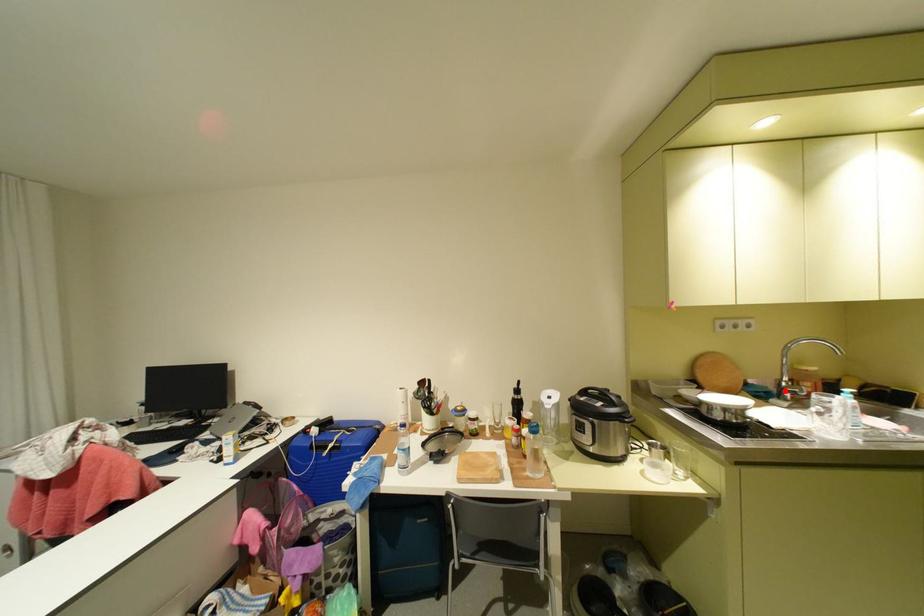
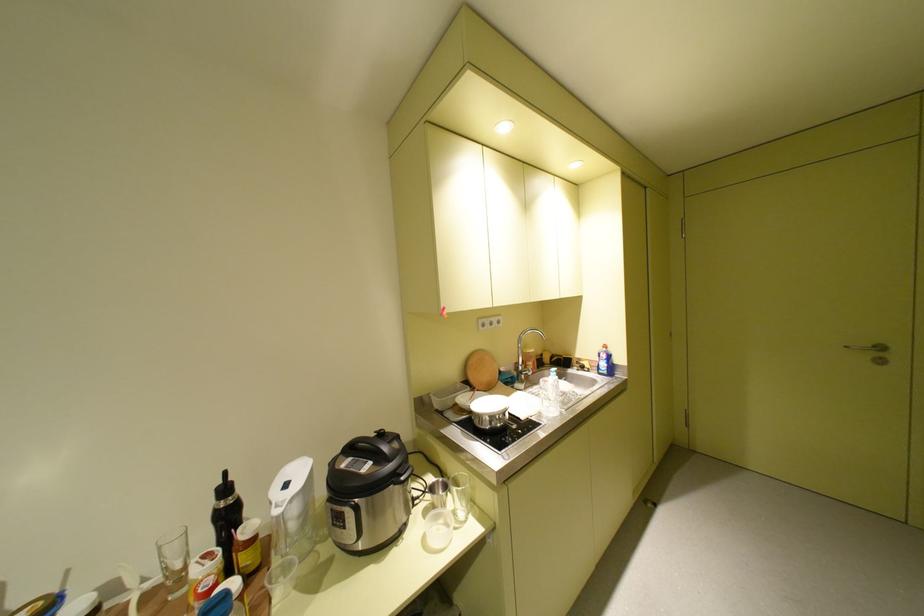
Find the pixel in the second image that matches the highlighted location in the first image.

(526, 374)